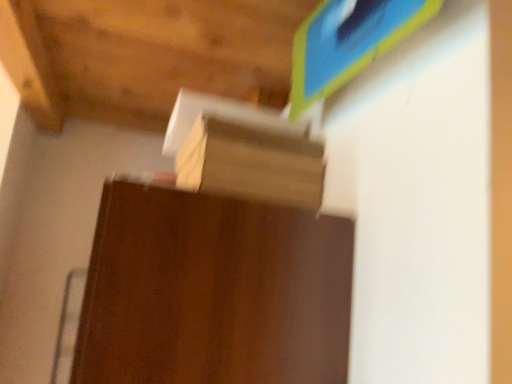
Question: Would you say dark wood table at center is inside or outside brown cardboard at center?

Choices:
 (A) inside
 (B) outside

Answer: (B)

Question: From the image's perspective, is dark wood table at center above or below brown cardboard at center?

Choices:
 (A) below
 (B) above

Answer: (A)

Question: Considering the positions of dark wood table at center and brown cardboard at center in the image, is dark wood table at center taller or shorter than brown cardboard at center?

Choices:
 (A) short
 (B) tall

Answer: (B)

Question: From a real-world perspective, relative to dark wood table at center, is brown cardboard at center vertically above or below?

Choices:
 (A) below
 (B) above

Answer: (B)

Question: Do you think brown cardboard at center is within dark wood table at center, or outside of it?

Choices:
 (A) inside
 (B) outside

Answer: (B)

Question: Looking at the image, does brown cardboard at center seem bigger or smaller compared to dark wood table at center?

Choices:
 (A) big
 (B) small

Answer: (B)

Question: From the image's perspective, is brown cardboard at center above or below dark wood table at center?

Choices:
 (A) above
 (B) below

Answer: (A)